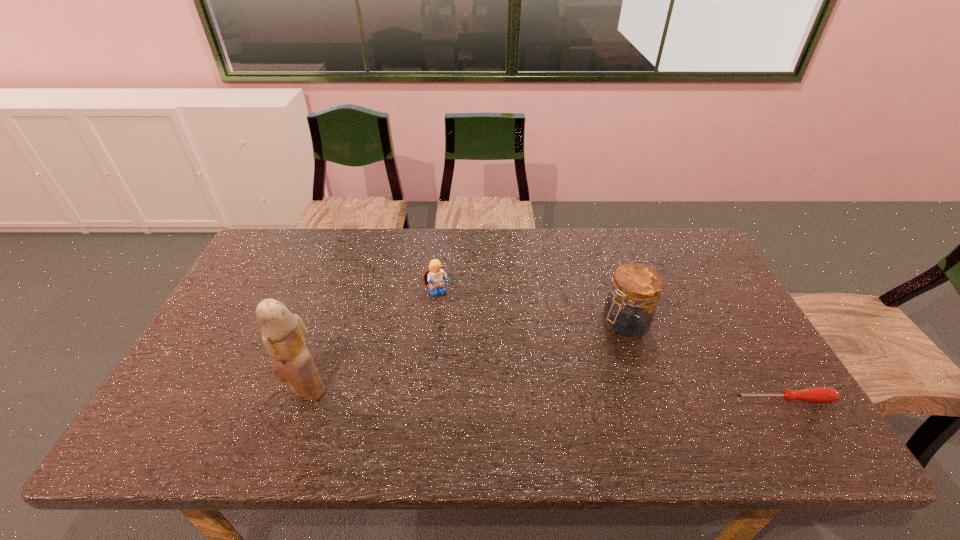
Where is `the tallest object`? the tallest object is located at coordinates (283, 333).

Where is `figurine`? The height and width of the screenshot is (540, 960). figurine is located at coordinates (283, 333).

What are the coordinates of `the rightmost object` in the screenshot? It's located at (816, 394).

The image size is (960, 540). I want to click on the shortest object, so click(816, 394).

Find the location of a particular element. This screenshot has width=960, height=540. the second object from right to left is located at coordinates (629, 310).

At what (x,y) coordinates should I click in order to perform the action: click on jar. Please return your answer as a coordinate pair (x, y). Image resolution: width=960 pixels, height=540 pixels. Looking at the image, I should click on (629, 310).

Locate an element on the screen. The image size is (960, 540). the third tallest object is located at coordinates (436, 275).

The height and width of the screenshot is (540, 960). Identify the location of the farthest object. (436, 275).

Find the location of a particular element. The image size is (960, 540). vacant space located 0.160m on the front-facing side of the tallest object is located at coordinates (216, 389).

Locate an element on the screen. The height and width of the screenshot is (540, 960). vacant space located on the front-facing side of the tallest object is located at coordinates (253, 389).